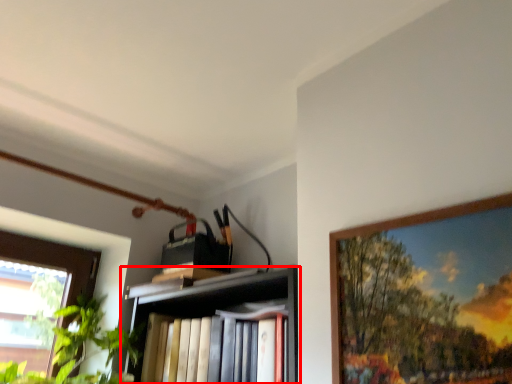
Question: Considering the relative positions of shelf (annotated by the red box) and picture frame in the image provided, where is shelf (annotated by the red box) located with respect to the staircase?

Choices:
 (A) left
 (B) right

Answer: (A)